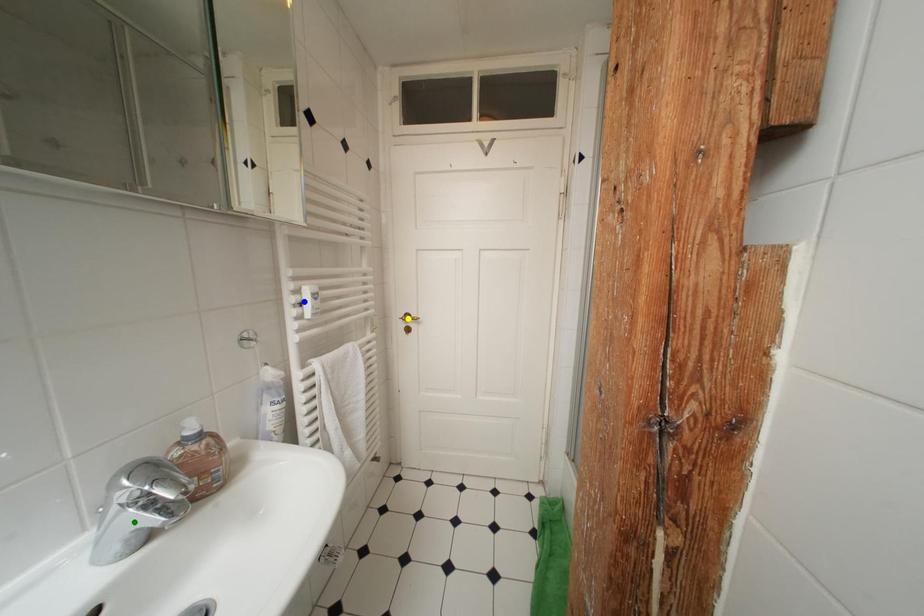
Order these from nearest to farthest:
blue point | yellow point | green point

green point, blue point, yellow point